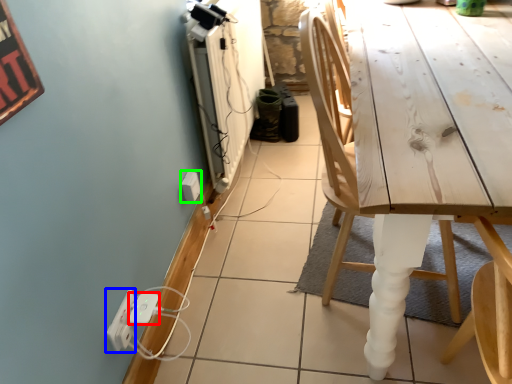
Question: Considering the real-world distances, which object is farthest from extension cord (highlighted by a red box)? electric outlet (highlighted by a blue box) or electric outlet (highlighted by a green box)?

Choices:
 (A) electric outlet
 (B) electric outlet

Answer: (B)